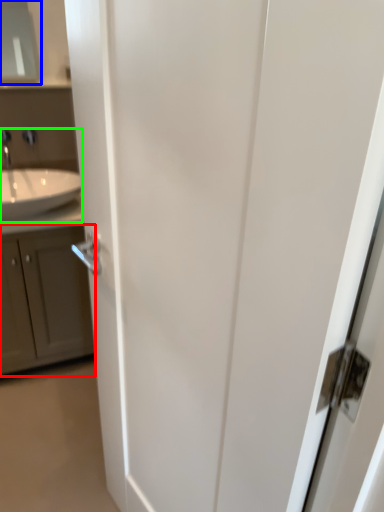
Question: Based on their relative distances, which object is nearer to cabinetry (highlighted by a red box)? Choose from medicine cabinet (highlighted by a blue box) and sink (highlighted by a green box).

Choices:
 (A) medicine cabinet
 (B) sink

Answer: (B)